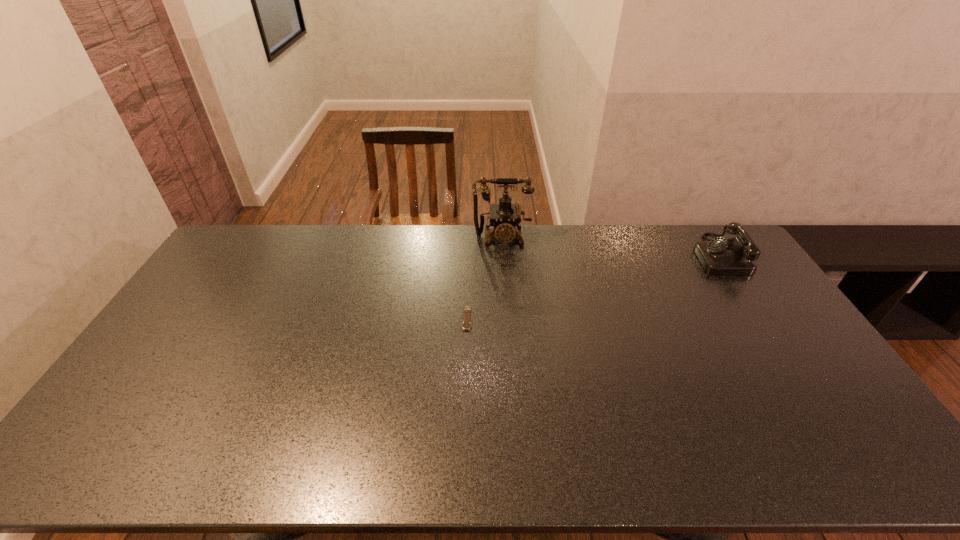
The height and width of the screenshot is (540, 960). Find the location of `the tallest object`. the tallest object is located at coordinates (504, 216).

Find the location of a particular element. The width and height of the screenshot is (960, 540). the taller telephone is located at coordinates (504, 216).

Where is `the shorter telephone`? The image size is (960, 540). the shorter telephone is located at coordinates (735, 256).

Find the location of `the second shortest object`. the second shortest object is located at coordinates (735, 256).

The height and width of the screenshot is (540, 960). Find the location of `the nearest object`. the nearest object is located at coordinates (466, 325).

Identify the location of watch. This screenshot has height=540, width=960. (466, 325).

Identify the location of vacant space located on the rotary dial of the taller telephone. (504, 279).

Locate an element on the screen. This screenshot has height=540, width=960. vacant area located on the dial of the shorter telephone is located at coordinates (638, 255).

The width and height of the screenshot is (960, 540). In order to click on vacant space situated on the dial of the shorter telephone in this screenshot , I will do `click(682, 255)`.

Find the location of `free space located on the dial of the shorter telephone`. free space located on the dial of the shorter telephone is located at coordinates (658, 255).